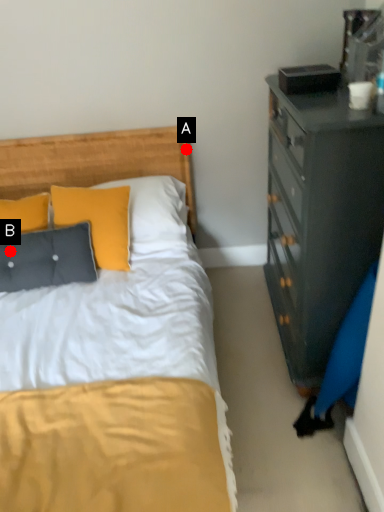
Question: Two points are circled on the image, labeled by A and B beside each circle. Which point is further to the camera?

Choices:
 (A) A is further
 (B) B is further

Answer: (A)